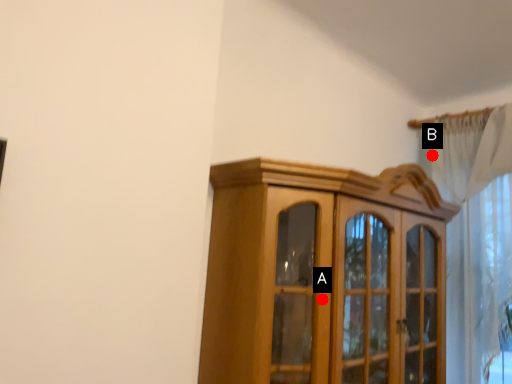
Question: Two points are circled on the image, labeled by A and B beside each circle. Which point appears closest to the camera in this image?

Choices:
 (A) A is closer
 (B) B is closer

Answer: (A)